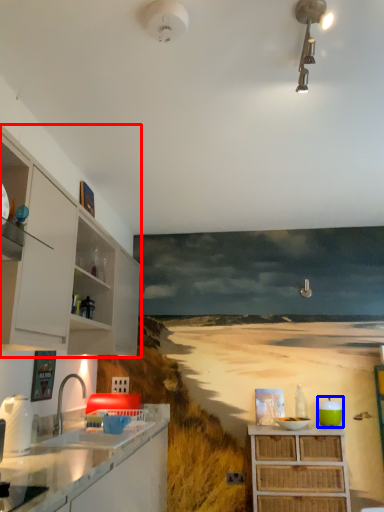
Question: Which of the following is the farthest to the observer, cabinetry (highlighted by a red box) or appliance (highlighted by a blue box)?

Choices:
 (A) cabinetry
 (B) appliance

Answer: (B)